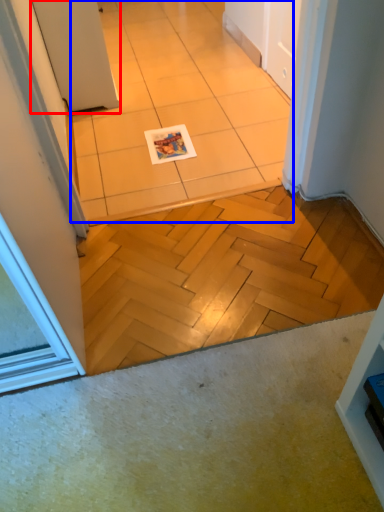
Question: Which object appears farthest to the camera in this image, door (highlighted by a red box) or ceramic tile (highlighted by a blue box)?

Choices:
 (A) door
 (B) ceramic tile

Answer: (A)